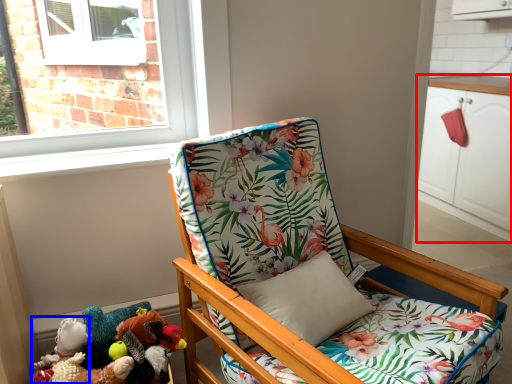
Question: Among these objects, which one is farthest to the camera, cabinetry (highlighted by a red box) or toy (highlighted by a blue box)?

Choices:
 (A) cabinetry
 (B) toy

Answer: (A)